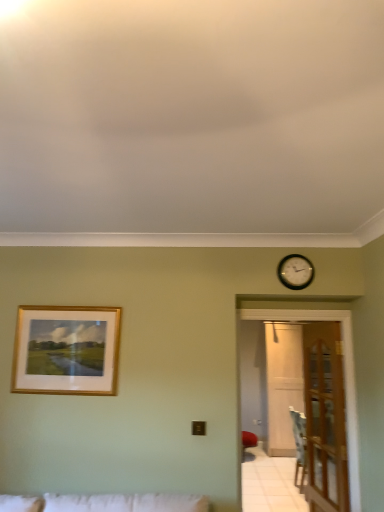
Question: From a real-world perspective, is black wooden clock at upper right located higher than wooden at right?

Choices:
 (A) no
 (B) yes

Answer: (B)

Question: From the image's perspective, is black wooden clock at upper right beneath wooden at right?

Choices:
 (A) no
 (B) yes

Answer: (A)

Question: Is black wooden clock at upper right to the right of wooden at right from the viewer's perspective?

Choices:
 (A) yes
 (B) no

Answer: (B)

Question: Is black wooden clock at upper right to the left of wooden at right from the viewer's perspective?

Choices:
 (A) yes
 (B) no

Answer: (A)

Question: Is black wooden clock at upper right positioned with its back to wooden at right?

Choices:
 (A) no
 (B) yes

Answer: (A)

Question: Is wooden at right inside black wooden clock at upper right?

Choices:
 (A) yes
 (B) no

Answer: (B)

Question: From a real-world perspective, is wooden at right positioned over clear glass door at right, arranged as the 2th glass door when viewed from the back, based on gravity?

Choices:
 (A) yes
 (B) no

Answer: (B)

Question: Would you say wooden at right is a long distance from clear glass door at right, the second glass door in the right-to-left sequence?

Choices:
 (A) yes
 (B) no

Answer: (B)

Question: From the image's perspective, is wooden at right under clear glass door at right, the second glass door in the right-to-left sequence?

Choices:
 (A) no
 (B) yes

Answer: (B)

Question: Could you tell me if wooden at right is facing clear glass door at right, arranged as the 2th glass door when viewed from the back?

Choices:
 (A) yes
 (B) no

Answer: (A)

Question: Considering the relative positions of wooden at right and clear glass door at right, the second glass door in the right-to-left sequence, in the image provided, is wooden at right behind clear glass door at right, the second glass door in the right-to-left sequence,?

Choices:
 (A) no
 (B) yes

Answer: (B)

Question: Is wooden at right to the left of clear glass door at right, the 1th glass door when ordered from front to back, from the viewer's perspective?

Choices:
 (A) no
 (B) yes

Answer: (A)

Question: From a real-world perspective, is clear glass door at right, arranged as the 2th glass door when viewed from the back, physically above black wooden clock at upper right?

Choices:
 (A) no
 (B) yes

Answer: (A)